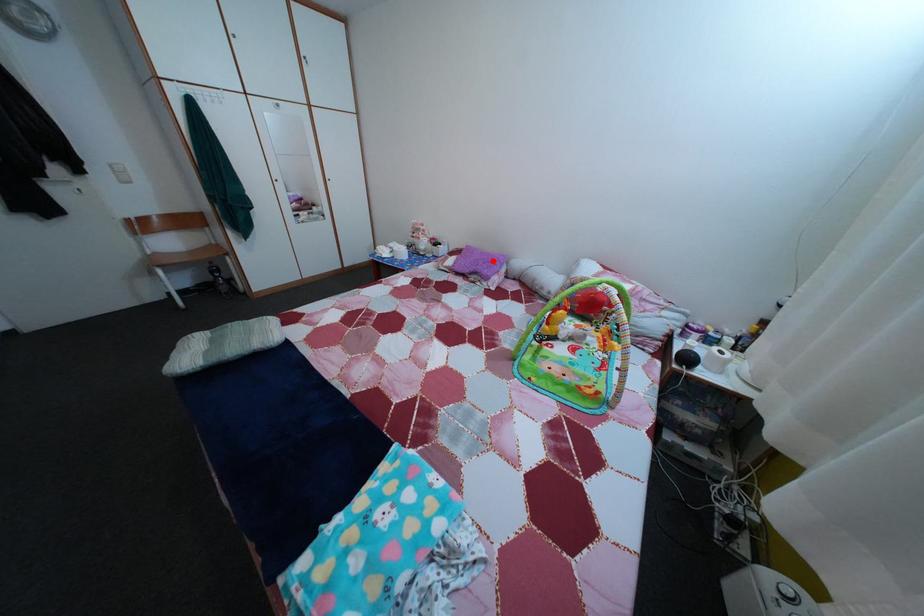
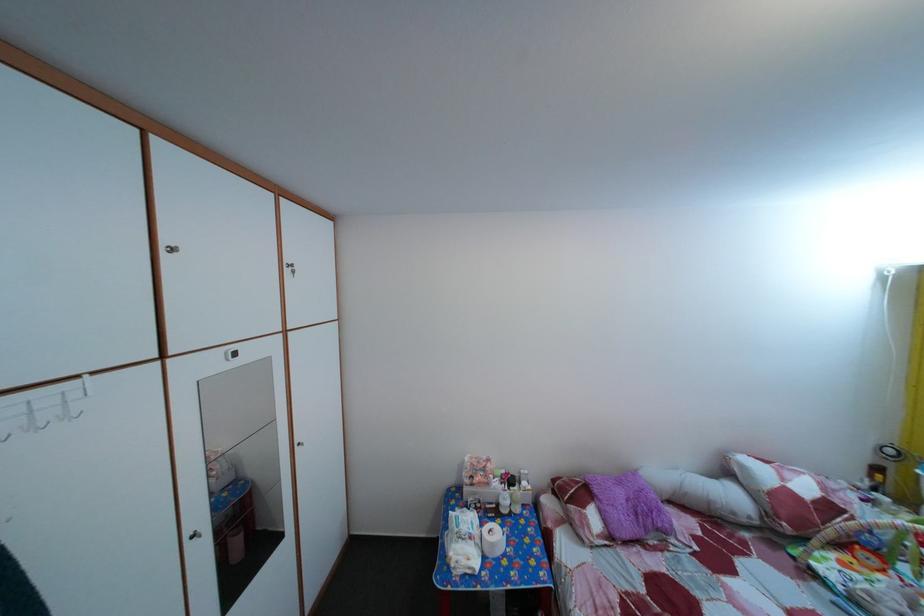
Question: I am providing you with two images of the same scene from different viewpoints. Given a red point in image1, look at the same physical point in image2. Is it:

Choices:
 (A) Closer to the viewpoint
 (B) Farther from the viewpoint

Answer: (B)